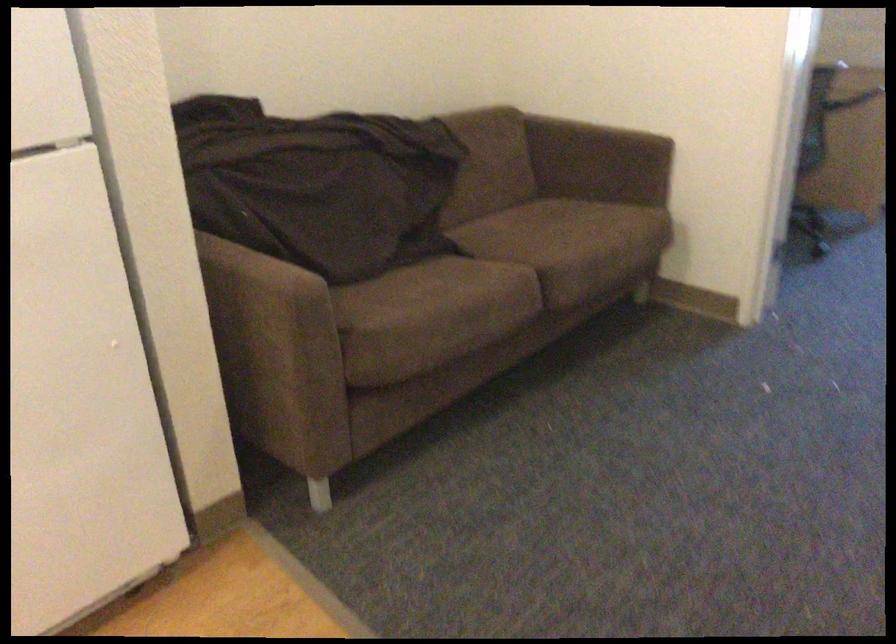
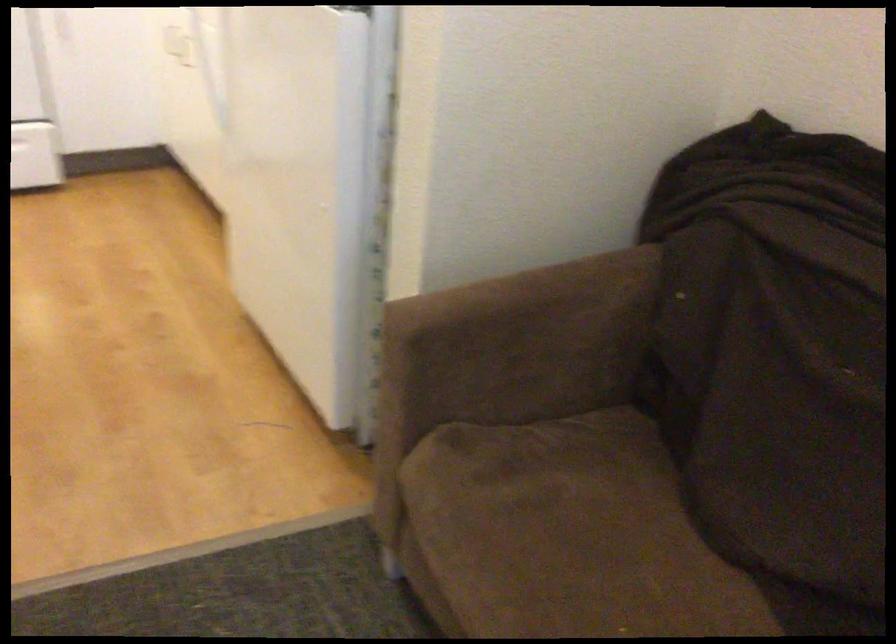
Find the pixel in the second image that matches point 254,263 in the first image.

(533, 310)